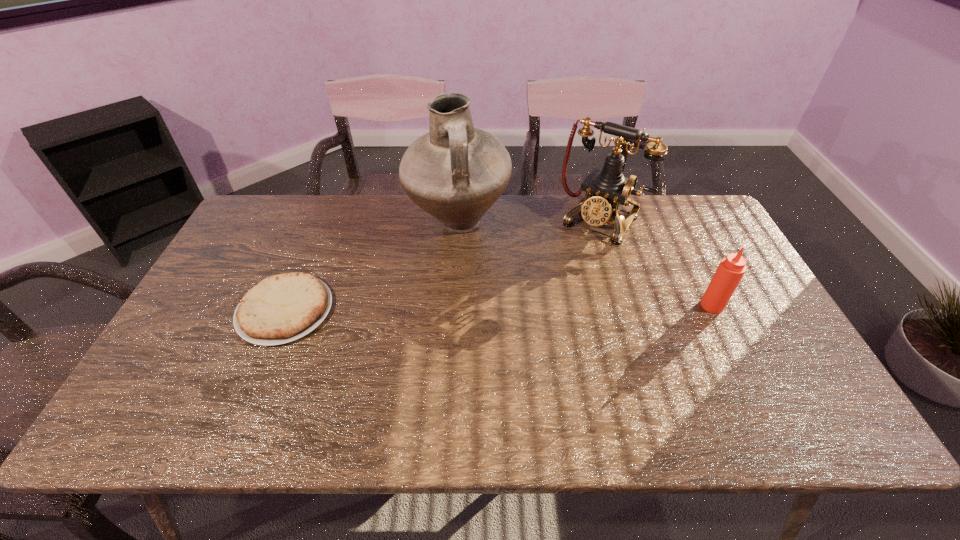
The image size is (960, 540). Find the location of `the leftmost object`. the leftmost object is located at coordinates (282, 308).

Locate an element on the screen. The height and width of the screenshot is (540, 960). the shortest object is located at coordinates (282, 308).

Locate an element on the screen. The height and width of the screenshot is (540, 960). Tabasco sauce is located at coordinates (731, 269).

At what (x,y) coordinates should I click in order to perform the action: click on the second shortest object. Please return your answer as a coordinate pair (x, y). The image size is (960, 540). Looking at the image, I should click on (731, 269).

The height and width of the screenshot is (540, 960). What are the coordinates of `the tallest object` in the screenshot? It's located at (455, 172).

What are the coordinates of `the second object from left to right` in the screenshot? It's located at (455, 172).

I want to click on the second tallest object, so click(x=607, y=190).

At what (x,y) coordinates should I click in order to perform the action: click on telephone. Please return your answer as a coordinate pair (x, y). The height and width of the screenshot is (540, 960). Looking at the image, I should click on (607, 190).

Find the location of a particular element. Image resolution: width=960 pixels, height=540 pixels. blank space located 0.210m on the right of the tortilla is located at coordinates pyautogui.click(x=411, y=310).

You are a GUI agent. You are given a task and a screenshot of the screen. Output one action in this format:
    pyautogui.click(x=<x>, y=<y>)
    Task: Click on the vacant space located on the left of the rightmost object
    This screenshot has width=960, height=540.
    Given the screenshot: What is the action you would take?
    pyautogui.click(x=567, y=306)